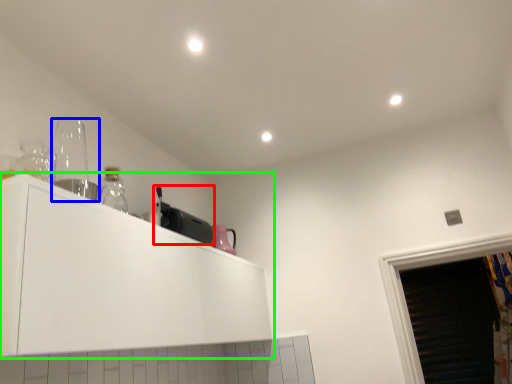
Question: Which object is the farthest from appliance (highlighted by a red box)? Choose among these: appliance (highlighted by a blue box) or cabinetry (highlighted by a green box).

Choices:
 (A) appliance
 (B) cabinetry

Answer: (A)